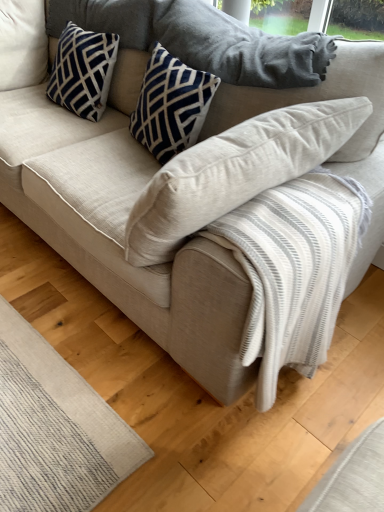
What do you see at coordinates (83, 71) in the screenshot? I see `navy blue printed cushion at upper left, the 1th pillow when ordered from left to right` at bounding box center [83, 71].

In order to face navy blue printed cushion at upper left, the 1th pillow when ordered from left to right, should I rotate leftwards or rightwards?

A 14.560 degree turn to the left will do.

The height and width of the screenshot is (512, 384). In order to click on navy blue printed cushion at upper left, which ranks as the 2th pillow in right-to-left order in this screenshot , I will do `click(83, 71)`.

Measure the distance between point [63,70] and camera.

Point [63,70] and camera are 6.20 feet apart from each other.

What do you see at coordinates (171, 105) in the screenshot? I see `navy velvet pillow at upper center, positioned as the 1th pillow in right-to-left order` at bounding box center [171, 105].

At what (x,y) coordinates should I click in order to perform the action: click on navy velvet pillow at upper center, which is the 2th pillow from left to right. Please return your answer as a coordinate pair (x, y). Looking at the image, I should click on 171,105.

Identify the location of navy blue printed cushion at upper left, which ranks as the 2th pillow in right-to-left order. This screenshot has height=512, width=384. (83, 71).

Consider the image. Considering the relative positions of navy velvet pillow at upper center, which is the 2th pillow from left to right, and navy blue printed cushion at upper left, the 1th pillow when ordered from left to right, in the image provided, is navy velvet pillow at upper center, which is the 2th pillow from left to right, to the left or to the right of navy blue printed cushion at upper left, the 1th pillow when ordered from left to right,?

navy velvet pillow at upper center, which is the 2th pillow from left to right, is positioned on navy blue printed cushion at upper left, the 1th pillow when ordered from left to right,'s right side.

Is navy velvet pillow at upper center, positioned as the 1th pillow in right-to-left order, positioned behind navy blue printed cushion at upper left, the 1th pillow when ordered from left to right?

No.

Which point is more distant from viewer, (141, 96) or (57, 96)?

The point (57, 96) is farther.

In the scene shown: From the image's perspective, which object appears higher, navy velvet pillow at upper center, positioned as the 1th pillow in right-to-left order, or navy blue printed cushion at upper left, which ranks as the 2th pillow in right-to-left order?

navy blue printed cushion at upper left, which ranks as the 2th pillow in right-to-left order, is shown above in the image.

From a real-world perspective, is navy velvet pillow at upper center, which is the 2th pillow from left to right, located higher than navy blue printed cushion at upper left, which ranks as the 2th pillow in right-to-left order?

Yes, from a real-world perspective, navy velvet pillow at upper center, which is the 2th pillow from left to right, is over navy blue printed cushion at upper left, which ranks as the 2th pillow in right-to-left order

Is navy velvet pillow at upper center, positioned as the 1th pillow in right-to-left order, wider than navy blue printed cushion at upper left, the 1th pillow when ordered from left to right?

Incorrect, the width of navy velvet pillow at upper center, positioned as the 1th pillow in right-to-left order, does not surpass that of navy blue printed cushion at upper left, the 1th pillow when ordered from left to right.

Consider the image. Who is shorter, navy velvet pillow at upper center, positioned as the 1th pillow in right-to-left order, or navy blue printed cushion at upper left, the 1th pillow when ordered from left to right?

navy blue printed cushion at upper left, the 1th pillow when ordered from left to right.

Who is bigger, navy velvet pillow at upper center, which is the 2th pillow from left to right, or navy blue printed cushion at upper left, which ranks as the 2th pillow in right-to-left order?

navy blue printed cushion at upper left, which ranks as the 2th pillow in right-to-left order, is bigger.

Is navy velvet pillow at upper center, which is the 2th pillow from left to right, inside or outside of navy blue printed cushion at upper left, which ranks as the 2th pillow in right-to-left order?

navy velvet pillow at upper center, which is the 2th pillow from left to right, lies outside navy blue printed cushion at upper left, which ranks as the 2th pillow in right-to-left order.

Is navy velvet pillow at upper center, which is the 2th pillow from left to right, far from navy blue printed cushion at upper left, which ranks as the 2th pillow in right-to-left order?

No, there isn't a large distance between navy velvet pillow at upper center, which is the 2th pillow from left to right, and navy blue printed cushion at upper left, which ranks as the 2th pillow in right-to-left order.

Is navy velvet pillow at upper center, positioned as the 1th pillow in right-to-left order, positioned with its back to navy blue printed cushion at upper left, the 1th pillow when ordered from left to right?

No, navy velvet pillow at upper center, positioned as the 1th pillow in right-to-left order,'s orientation is not away from navy blue printed cushion at upper left, the 1th pillow when ordered from left to right.

How far apart are navy velvet pillow at upper center, which is the 2th pillow from left to right, and navy blue printed cushion at upper left, the 1th pillow when ordered from left to right?

navy velvet pillow at upper center, which is the 2th pillow from left to right, is 16.67 inches away from navy blue printed cushion at upper left, the 1th pillow when ordered from left to right.

Find the location of a particular element. pillow on the left of the navy velvet pillow at upper center, which is the 2th pillow from left to right is located at coordinates [x=83, y=71].

Is navy blue printed cushion at upper left, the 1th pillow when ordered from left to right, to the left of navy velvet pillow at upper center, which is the 2th pillow from left to right, from the viewer's perspective?

Yes, navy blue printed cushion at upper left, the 1th pillow when ordered from left to right, is to the left of navy velvet pillow at upper center, which is the 2th pillow from left to right.

Is navy blue printed cushion at upper left, the 1th pillow when ordered from left to right, closer to the viewer compared to navy velvet pillow at upper center, positioned as the 1th pillow in right-to-left order?

No, it is behind navy velvet pillow at upper center, positioned as the 1th pillow in right-to-left order.

Considering the points (62, 53) and (181, 137), which point is in front, point (62, 53) or point (181, 137)?

The point (181, 137) is closer.

From the image's perspective, which one is positioned higher, navy blue printed cushion at upper left, the 1th pillow when ordered from left to right, or navy velvet pillow at upper center, positioned as the 1th pillow in right-to-left order?

navy blue printed cushion at upper left, the 1th pillow when ordered from left to right, is shown above in the image.

From a real-world perspective, is navy blue printed cushion at upper left, which ranks as the 2th pillow in right-to-left order, located beneath navy velvet pillow at upper center, positioned as the 1th pillow in right-to-left order?

Yes, from a real-world perspective, navy blue printed cushion at upper left, which ranks as the 2th pillow in right-to-left order, is under navy velvet pillow at upper center, positioned as the 1th pillow in right-to-left order.

Consider the image. In terms of width, does navy blue printed cushion at upper left, the 1th pillow when ordered from left to right, look wider or thinner when compared to navy velvet pillow at upper center, which is the 2th pillow from left to right?

Clearly, navy blue printed cushion at upper left, the 1th pillow when ordered from left to right, has more width compared to navy velvet pillow at upper center, which is the 2th pillow from left to right.

Can you confirm if navy blue printed cushion at upper left, the 1th pillow when ordered from left to right, is taller than navy velvet pillow at upper center, positioned as the 1th pillow in right-to-left order?

No, navy blue printed cushion at upper left, the 1th pillow when ordered from left to right, is not taller than navy velvet pillow at upper center, positioned as the 1th pillow in right-to-left order.

Which of these two, navy blue printed cushion at upper left, which ranks as the 2th pillow in right-to-left order, or navy velvet pillow at upper center, which is the 2th pillow from left to right, is bigger?

With larger size is navy blue printed cushion at upper left, which ranks as the 2th pillow in right-to-left order.

Is navy blue printed cushion at upper left, the 1th pillow when ordered from left to right, completely or partially outside of navy velvet pillow at upper center, positioned as the 1th pillow in right-to-left order?

Yes, navy blue printed cushion at upper left, the 1th pillow when ordered from left to right, is outside of navy velvet pillow at upper center, positioned as the 1th pillow in right-to-left order.

Is navy blue printed cushion at upper left, which ranks as the 2th pillow in right-to-left order, directly adjacent to navy velvet pillow at upper center, which is the 2th pillow from left to right?

navy blue printed cushion at upper left, which ranks as the 2th pillow in right-to-left order, and navy velvet pillow at upper center, which is the 2th pillow from left to right, are clearly separated.

Is navy blue printed cushion at upper left, the 1th pillow when ordered from left to right, oriented towards navy velvet pillow at upper center, positioned as the 1th pillow in right-to-left order?

No.

How many degrees apart are the facing directions of navy blue printed cushion at upper left, the 1th pillow when ordered from left to right, and navy velvet pillow at upper center, positioned as the 1th pillow in right-to-left order?

They differ by 0.000314 degrees in their facing directions.

Image resolution: width=384 pixels, height=512 pixels. I want to click on pillow that appears behind the navy velvet pillow at upper center, positioned as the 1th pillow in right-to-left order, so click(x=83, y=71).

Image resolution: width=384 pixels, height=512 pixels. I want to click on pillow that is above the navy velvet pillow at upper center, positioned as the 1th pillow in right-to-left order (from the image's perspective), so click(83, 71).

Find the location of a particular element. This screenshot has width=384, height=512. pillow above the navy blue printed cushion at upper left, which ranks as the 2th pillow in right-to-left order (from a real-world perspective) is located at coordinates (171, 105).